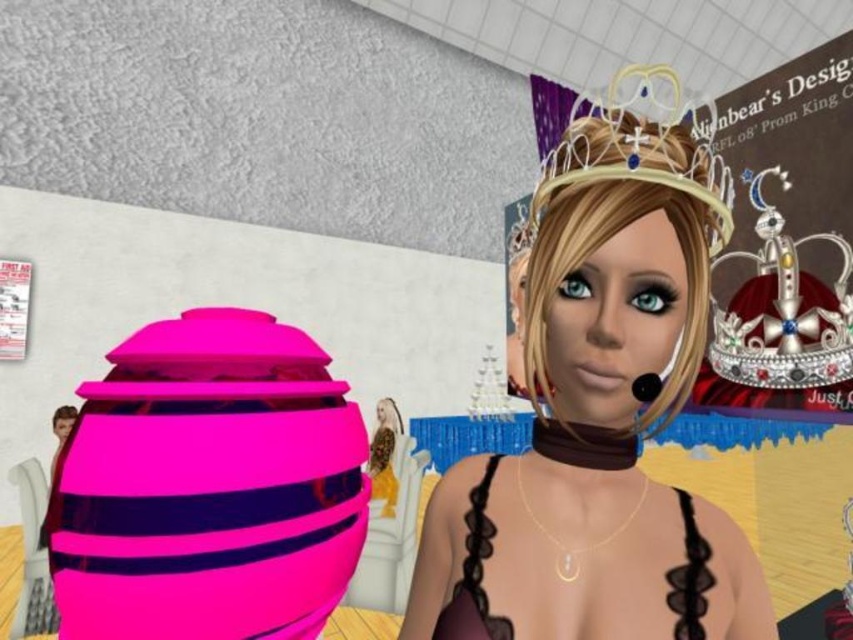
You are a photographer taking a picture of the scene. You notice two points marked in the image at coordinates point [442,573] and point [473,492]. Which point should you focus on to ensure the closer one is sharp?

You should focus on point [442,573] because it is closer to the camera than point [473,492].

You are a guest at a party and see two crowns displayed above the entrance. The shiny plastic crown at upper center and the shiny silver crown at upper center. Which crown is wider?

The shiny plastic crown at upper center is wider than the shiny silver crown at upper center.